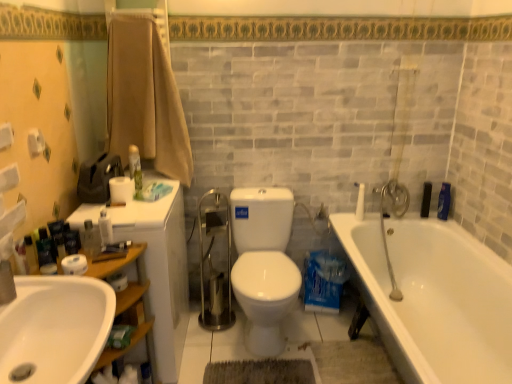
What do you see at coordinates (394, 216) in the screenshot?
I see `white ceramic faucet at upper right` at bounding box center [394, 216].

Describe the element at coordinates (55, 328) in the screenshot. I see `white glossy sink at lower left` at that location.

What do you see at coordinates (145, 98) in the screenshot? The height and width of the screenshot is (384, 512). I see `beige cotton towel at upper left` at bounding box center [145, 98].

Locate an element on the screen. white matte toilet paper at lower left, positioned as the 2th toilet paper in bottom-to-top order is located at coordinates (74, 264).

In the scene shown: From the image's perspective, does matte white lotion at left, which is the 1th toiletry from left to right, appear higher than white glossy medicine cabinet at left?

Yes.

Is matte white lotion at left, which ranks as the 2th toiletry in front-to-back order, turned away from white glossy medicine cabinet at left?

matte white lotion at left, which ranks as the 2th toiletry in front-to-back order, does not have its back to white glossy medicine cabinet at left.

You are a GUI agent. You are given a task and a screenshot of the screen. Output one action in this format:
    pyautogui.click(x=<x>, y=<y>)
    Task: Click on the 2nd toiletry in front of the white glossy medicine cabinet at left
    This screenshot has height=384, width=512.
    Given the screenshot: What is the action you would take?
    pyautogui.click(x=31, y=254)

From a real-world perspective, is matte white lotion at left, which ranks as the 2th toiletry in front-to-back order, on white glossy medicine cabinet at left?

Yes.

Considering the relative sizes of white glossy bathtub at lower right and blue plastic bottle at right, the 6th toiletry from the left, in the image provided, is white glossy bathtub at lower right thinner than blue plastic bottle at right, the 6th toiletry from the left,?

No.

From a real-world perspective, does white glossy bathtub at lower right stand above blue plastic bottle at right, the 6th toiletry from the left?

No, from a real-world perspective, white glossy bathtub at lower right is not above blue plastic bottle at right, the 6th toiletry from the left.

Is white glossy bathtub at lower right turned away from blue plastic bottle at right, which appears as the second toiletry when viewed from the back?

white glossy bathtub at lower right is not turned away from blue plastic bottle at right, which appears as the second toiletry when viewed from the back.

Find the location of `bathtub below the white ceramic faucet at upper right (from the image's perspective)`. bathtub below the white ceramic faucet at upper right (from the image's perspective) is located at coordinates (434, 297).

From the image's perspective, which is above, white glossy bathtub at lower right or white ceramic faucet at upper right?

From the image's view, white ceramic faucet at upper right is above.

Considering the positions of objects white glossy bathtub at lower right and white ceramic faucet at upper right in the image provided, who is more to the left, white glossy bathtub at lower right or white ceramic faucet at upper right?

white glossy bathtub at lower right is more to the left.

Looking at this image, between white glossy bathtub at lower right and white ceramic faucet at upper right, which one has larger size?

Bigger between the two is white glossy bathtub at lower right.

Looking at the image, does blue plastic bottle at right, the 6th toiletry from the left, seem bigger or smaller compared to white ceramic faucet at upper right?

In the image, blue plastic bottle at right, the 6th toiletry from the left, appears to be smaller than white ceramic faucet at upper right.

Is point (444, 213) farther from camera compared to point (397, 189)?

No, it is in front of (397, 189).

Could you tell me if blue plastic bottle at right, the 5th toiletry when ordered from front to back, is turned towards white ceramic faucet at upper right?

No, blue plastic bottle at right, the 5th toiletry when ordered from front to back, is not facing towards white ceramic faucet at upper right.

Image resolution: width=512 pixels, height=384 pixels. Identify the location of plumbing fixture lying in front of the blue plastic bottle at right, the 6th toiletry from the left. (394, 216).

Does point (133, 174) lie in front of point (61, 262)?

No.

Is green matte spray can at upper left, the fourth toiletry positioned from the front, positioned far away from white matte toilet paper at lower left, which is counted as the 3th toilet paper, starting from the back?

No, green matte spray can at upper left, the fourth toiletry positioned from the front, is in close proximity to white matte toilet paper at lower left, which is counted as the 3th toilet paper, starting from the back.

Consider the image. Considering the sizes of objects green matte spray can at upper left, the 4th toiletry in the left-to-right sequence, and white matte toilet paper at lower left, which is counted as the 2th toilet paper, starting from the top, in the image provided, who is taller, green matte spray can at upper left, the 4th toiletry in the left-to-right sequence, or white matte toilet paper at lower left, which is counted as the 2th toilet paper, starting from the top,?

green matte spray can at upper left, the 4th toiletry in the left-to-right sequence, is taller.

Does green matte spray can at upper left, the 4th toiletry in the left-to-right sequence, have a lesser width compared to white matte toilet paper at lower left, positioned as the 2th toilet paper in bottom-to-top order?

Yes.

Considering the relative sizes of beige cotton towel at upper left and white glossy medicine cabinet at left in the image provided, is beige cotton towel at upper left bigger than white glossy medicine cabinet at left?

No.

From a real-world perspective, who is located lower, beige cotton towel at upper left or white glossy medicine cabinet at left?

white glossy medicine cabinet at left, from a real-world perspective.

Image resolution: width=512 pixels, height=384 pixels. Identify the location of medicine cabinet below the beige cotton towel at upper left (from the image's perspective). (161, 266).

Considering their positions, is beige cotton towel at upper left located in front of or behind white glossy medicine cabinet at left?

In the image, beige cotton towel at upper left appears behind white glossy medicine cabinet at left.

Considering the positions of point (42, 243) and point (447, 198), is point (42, 243) closer or farther from the camera than point (447, 198)?

Point (42, 243).

Considering the relative sizes of white matte jar at lower left, positioned as the sixth toiletry in back-to-front order, and blue plastic bottle at right, which appears as the second toiletry when viewed from the back, in the image provided, is white matte jar at lower left, positioned as the sixth toiletry in back-to-front order, thinner than blue plastic bottle at right, which appears as the second toiletry when viewed from the back,?

Indeed, white matte jar at lower left, positioned as the sixth toiletry in back-to-front order, has a lesser width compared to blue plastic bottle at right, which appears as the second toiletry when viewed from the back.

Is white matte jar at lower left, positioned as the sixth toiletry in back-to-front order, facing away from blue plastic bottle at right, the 6th toiletry from the left?

No, white matte jar at lower left, positioned as the sixth toiletry in back-to-front order,'s orientation is not away from blue plastic bottle at right, the 6th toiletry from the left.

Measure the distance from white matte jar at lower left, acting as the 2th toiletry starting from the left, to blue plastic bottle at right, the 5th toiletry when ordered from front to back.

white matte jar at lower left, acting as the 2th toiletry starting from the left, and blue plastic bottle at right, the 5th toiletry when ordered from front to back, are 6.73 feet apart.

Locate an element on the screen. the 3rd toiletry to the left when counting from the white glossy medicine cabinet at left is located at coordinates (31, 254).

The image size is (512, 384). I want to click on bathtub lying below the blue plastic bottle at right, the 6th toiletry from the left (from the image's perspective), so click(434, 297).

Looking at this image, when comparing their distances from white glossy bathtub at lower right, does black matte razor at right, placed as the second toiletry when sorted from right to left, or white plastic container at left, the fourth toiletry when ordered from right to left, seem closer?

black matte razor at right, placed as the second toiletry when sorted from right to left, lies closer to white glossy bathtub at lower right than the other object.

Considering their positions, is white matte toilet paper at lower left, which is the third toilet paper in top-to-bottom order, positioned closer to white matte jar at lower left, positioned as the sixth toiletry in back-to-front order, than blue plastic bottle at right, which appears as the second toiletry when viewed from the back?

The object closer to white matte jar at lower left, positioned as the sixth toiletry in back-to-front order, is white matte toilet paper at lower left, which is the third toilet paper in top-to-bottom order.

Looking at the image, which one is located closer to white glossy medicine cabinet at left, white glossy bathtub at lower right or white matte toilet paper at lower left, which is counted as the 3th toilet paper, starting from the back?

The object closer to white glossy medicine cabinet at left is white matte toilet paper at lower left, which is counted as the 3th toilet paper, starting from the back.

When comparing their distances from white matte jar at lower left, which ranks as the first toiletry in front-to-back order, does white glossy bathtub at lower right or black matte razor at right, the 5th toiletry when ordered from left to right, seem further?

Based on the image, black matte razor at right, the 5th toiletry when ordered from left to right, appears to be further to white matte jar at lower left, which ranks as the first toiletry in front-to-back order.

Looking at the image, which one is located further to white ceramic faucet at upper right, white matte toilet paper at upper left, acting as the first toilet paper starting from the top, or beige cotton towel at upper left?

white matte toilet paper at upper left, acting as the first toilet paper starting from the top, is positioned further to the anchor white ceramic faucet at upper right.

Based on their spatial positions, is green matte spray can at upper left, the 4th toiletry in the left-to-right sequence, or white glossy bathtub at lower right closer to white matte jar at lower left, which ranks as the first toiletry in front-to-back order?

The object closer to white matte jar at lower left, which ranks as the first toiletry in front-to-back order, is green matte spray can at upper left, the 4th toiletry in the left-to-right sequence.

From the image, which object appears to be farther from black matte razor at right, placed as the second toiletry when sorted from right to left, white matte toilet paper at lower left, marked as the second toilet paper in a back-to-front arrangement, or white glossy bathtub at lower right?

The object further to black matte razor at right, placed as the second toiletry when sorted from right to left, is white matte toilet paper at lower left, marked as the second toilet paper in a back-to-front arrangement.

Based on their spatial positions, is beige cotton towel at upper left or white matte toilet paper at upper left, the third toilet paper from the front, further from black matte razor at right, placed as the second toiletry when sorted from right to left?

white matte toilet paper at upper left, the third toilet paper from the front, is further to black matte razor at right, placed as the second toiletry when sorted from right to left.

I want to click on bath towel between white matte toilet paper at lower left, which is counted as the 2th toilet paper, starting from the top, and white glossy bathtub at lower right, so click(145, 98).

Find the location of `toilet paper between white glossy medicine cabinet at left and black matte razor at right, arranged as the first toiletry when viewed from the back, in the horizontal direction`. toilet paper between white glossy medicine cabinet at left and black matte razor at right, arranged as the first toiletry when viewed from the back, in the horizontal direction is located at coordinates (118, 281).

At what (x,y) coordinates should I click in order to perform the action: click on sink between white matte toilet paper at lower left, positioned as the 2th toilet paper in bottom-to-top order, and white ceramic faucet at upper right, in the horizontal direction. Please return your answer as a coordinate pair (x, y). This screenshot has height=384, width=512. Looking at the image, I should click on (55, 328).

Find the location of a particular element. Image resolution: width=512 pixels, height=384 pixels. toilet paper between beige cotton towel at upper left and matte white lotion at left, acting as the 5th toiletry starting from the back, in the up-down direction is located at coordinates (121, 190).